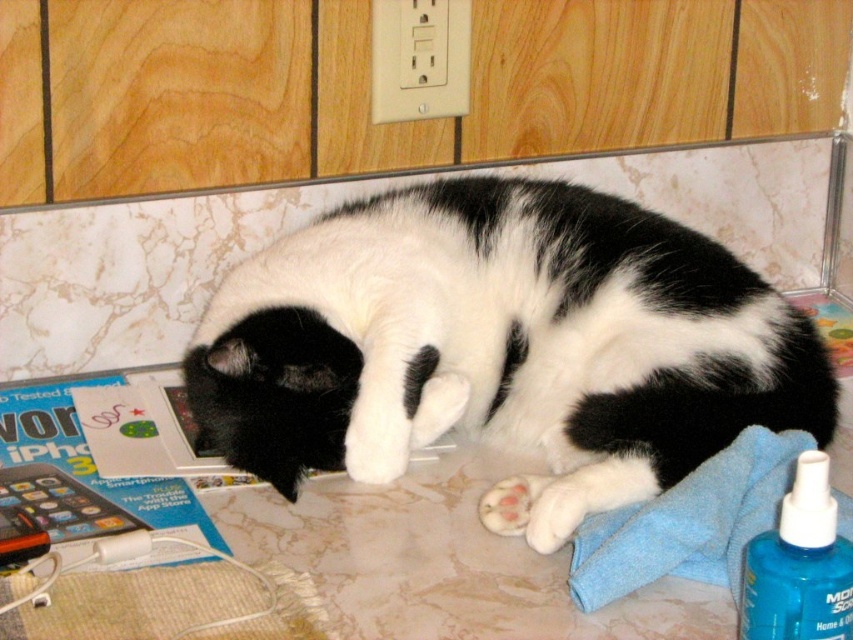
You are a photographer trying to capture the black and white fur cat at center in the image. If you want to focus on the cat, which object should you avoid blocking the camera view of?

You should avoid blocking the camera view of the black and white fur cat at center.

From the picture: You are a housekeeper who needs to clean the kitchen countertop where the black and white cat is resting. The blue plastic spray bottle at lower right is located at point (799, 564). Where should you place the spray bottle to avoid disturbing the cat?

The blue plastic spray bottle at lower right should be placed away from the cat to avoid disturbing it. Since the cat is resting on the kitchen countertop, placing the spray bottle at point (799, 564) ensures it is located at the lower right corner, safely away from the cat.

You are a photographer trying to capture the black and white fur cat at center and the white soft paw at lower center in a single shot. Based on their positions, will the cat be entirely visible in the frame if you focus on the paw?

The black and white fur cat at center is above the white soft paw at lower center, so focusing on the paw might still allow the cat to be mostly visible in the frame, but part of its body could be slightly out of the shot depending on the camera angle and zoom level.